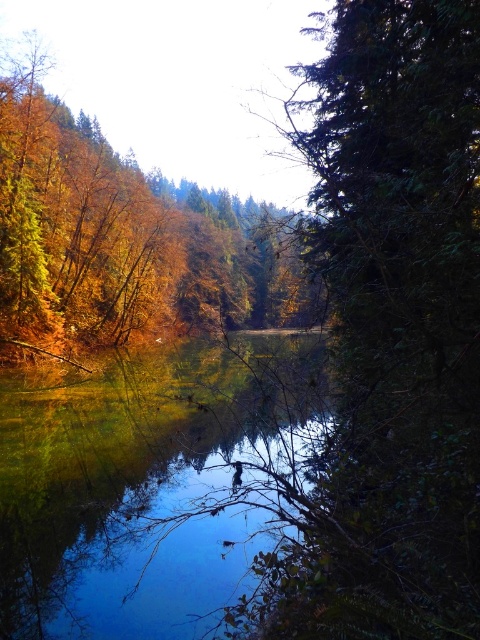
You are a photographer planning to capture the reflection of the green matte tree at right in the shiny reflective water at center. Based on the scene description, will the tree be visible in the water?

The green matte tree at right is positioned on the right side of shiny reflective water at center, so its reflection should be visible in the water since it is near the water.

In the scene shown: You are a bird flying over the serene natural scene. You want to land on the green matte tree at right. Based on its position, can you estimate where it is located in the image?

The green matte tree at right is located at point 0.522 on the horizontal axis and 0.819 on the vertical axis, which places it near the lower right portion of the image.